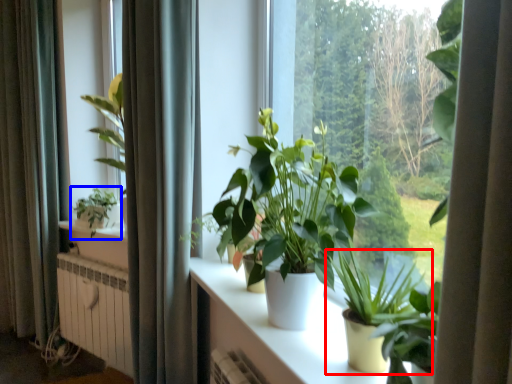
Question: Among these objects, which one is farthest to the camera, houseplant (highlighted by a red box) or houseplant (highlighted by a blue box)?

Choices:
 (A) houseplant
 (B) houseplant

Answer: (B)